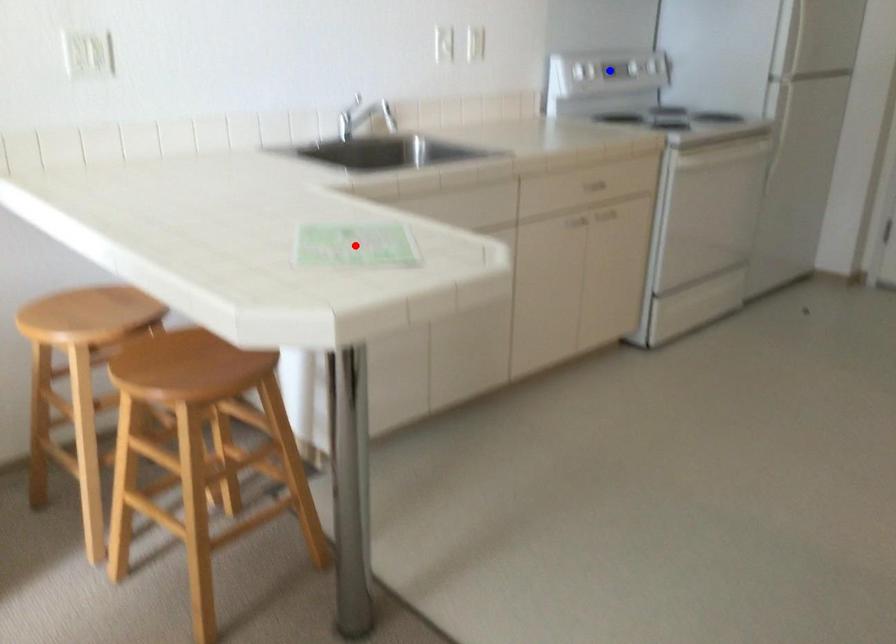
Question: In the image, two points are highlighted. Which point is nearer to the camera? Reply with the corresponding letter.

Choices:
 (A) blue point
 (B) red point

Answer: (B)